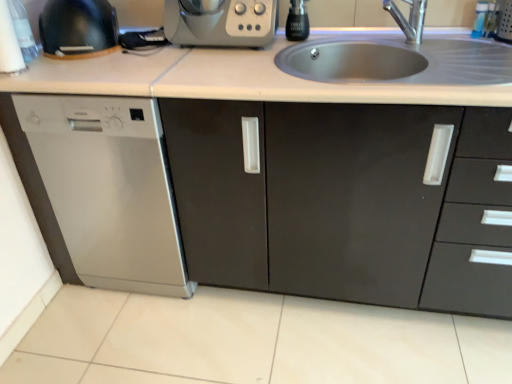
Question: Considering the relative positions of satin steel dishwasher at left and stainless steel sink at upper center in the image provided, is satin steel dishwasher at left to the left or to the right of stainless steel sink at upper center?

Choices:
 (A) left
 (B) right

Answer: (A)

Question: Is point (54, 165) closer or farther from the camera than point (366, 69)?

Choices:
 (A) farther
 (B) closer

Answer: (B)

Question: Which object is positioned farthest from the stainless steel sink at upper center?

Choices:
 (A) matte black kettle at upper left, which is the 1th appliance in left-to-right order
 (B) black glass bottle at upper center, acting as the first appliance starting from the right
 (C) silver metallic faucet at upper center
 (D) matte black cabinet at center
 (E) satin silver appliance at upper center

Answer: (A)

Question: Which object is positioned closest to the silver metallic faucet at upper center?

Choices:
 (A) satin steel dishwasher at left
 (B) satin silver appliance at upper center
 (C) matte black cabinet at center
 (D) stainless steel sink at upper center
 (E) matte black kettle at upper left, the second appliance when ordered from right to left

Answer: (D)